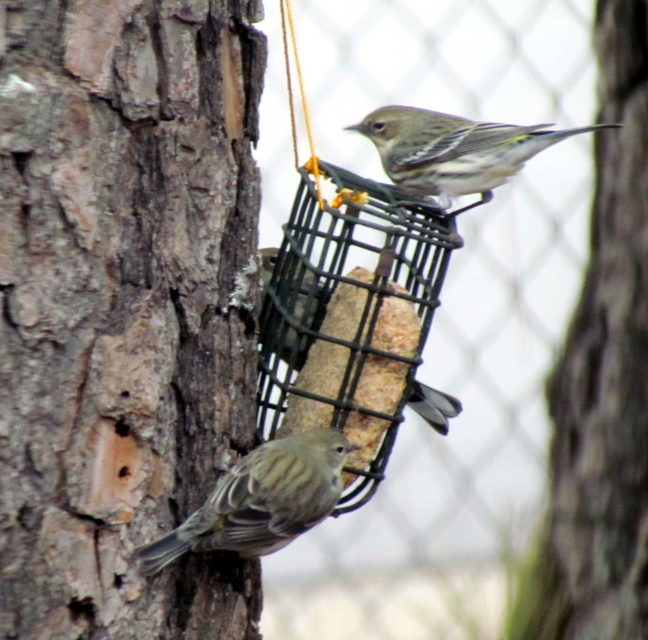
You are a birdwatcher trying to photograph the brown speckled bird at lower left. The camera you have can focus on subjects within 10 inches. Is the black wire mesh bird feeder at center too close to the bird to take a clear photo?

The black wire mesh bird feeder at center is 10.16 inches away from the brown speckled bird at lower left. Since the camera can focus within 10 inches, the feeder is slightly too close for the camera to focus properly on the bird.

You are standing 1.77 meters away from the point at coordinates (x=115, y=513) in the image. If you want to take a photo of the bird feeder and the birds, will you need to zoom in or out to include both the feeder and the birds in the frame?

Since you are 1.77 meters away from the point at coordinates (x=115, y=513), you will need to zoom out to include both the bird feeder and the birds in the frame.